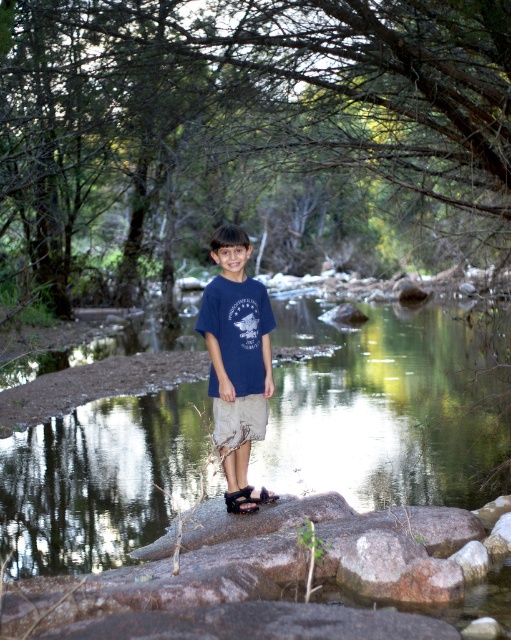
Question: Is blue cotton shirt at center positioned before black suede sandal at center?

Choices:
 (A) yes
 (B) no

Answer: (A)

Question: Which point is farther from the camera taking this photo?

Choices:
 (A) (260, 497)
 (B) (231, 496)
 (C) (240, 362)

Answer: (A)

Question: Which of the following is the farthest from the observer?

Choices:
 (A) clear water at rock center
 (B) black suede sandal at center
 (C) brown leather sandal at center

Answer: (B)

Question: Which point appears closest to the camera in this image?

Choices:
 (A) pyautogui.click(x=401, y=442)
 (B) pyautogui.click(x=241, y=497)
 (C) pyautogui.click(x=259, y=499)
 (D) pyautogui.click(x=240, y=285)

Answer: (B)

Question: Can you confirm if clear water at rock center is wider than blue cotton shirt at center?

Choices:
 (A) no
 (B) yes

Answer: (B)

Question: Does clear water at rock center have a greater width compared to brown leather sandal at center?

Choices:
 (A) yes
 (B) no

Answer: (A)